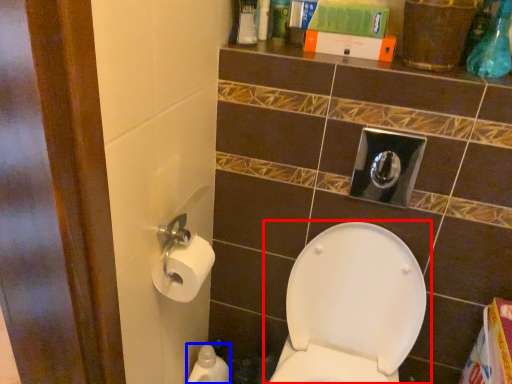
Question: Which object appears closest to the camera in this image, toilet (highlighted by a red box) or cleaning product (highlighted by a blue box)?

Choices:
 (A) toilet
 (B) cleaning product

Answer: (A)